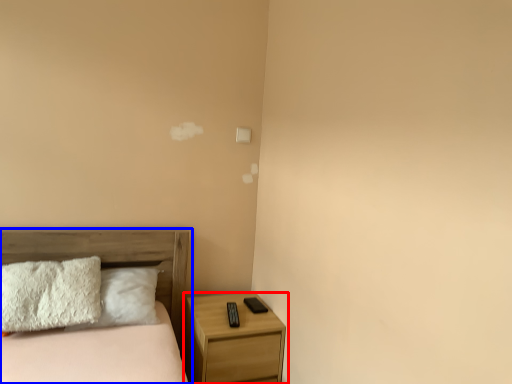
Question: Which object is closer to the camera taking this photo, nightstand (highlighted by a red box) or bed (highlighted by a blue box)?

Choices:
 (A) nightstand
 (B) bed

Answer: (B)